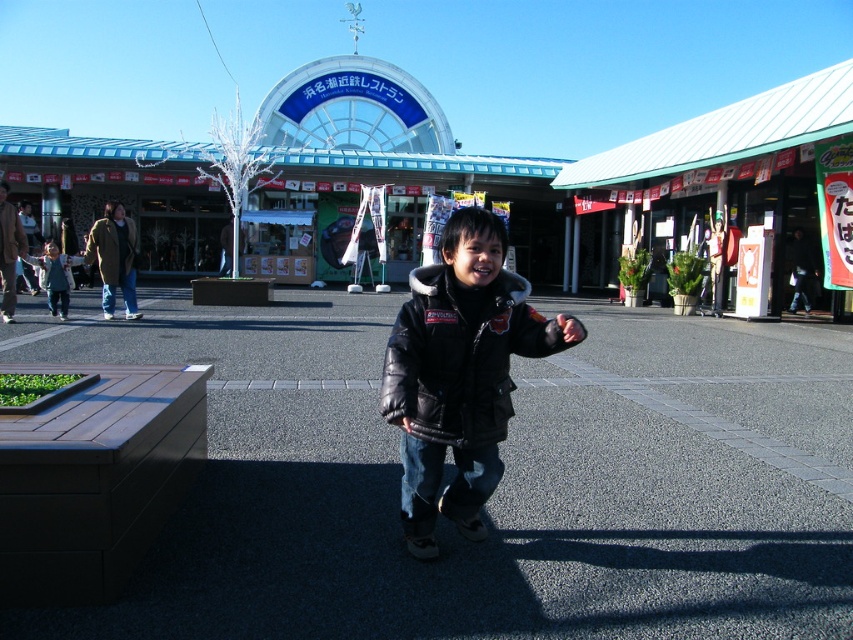
Question: Which point is farther to the camera?

Choices:
 (A) dark gray asphalt at center
 (B) matte black jacket at center

Answer: (B)

Question: Which object is farther from the camera taking this photo?

Choices:
 (A) matte black jacket at center
 (B) dark gray asphalt at center
 (C) black leather jacket at center
 (D) blue glass building at center

Answer: (D)

Question: Can you confirm if dark gray asphalt at center is positioned to the right of black leather jacket at center?

Choices:
 (A) no
 (B) yes

Answer: (A)

Question: Is dark gray asphalt at center above blue glass building at center?

Choices:
 (A) no
 (B) yes

Answer: (A)

Question: Among these objects, which one is farthest from the camera?

Choices:
 (A) black leather jacket at center
 (B) blue glass building at center
 (C) dark gray asphalt at center

Answer: (B)

Question: Can you confirm if blue glass building at center is positioned above matte black jacket at center?

Choices:
 (A) no
 (B) yes

Answer: (B)